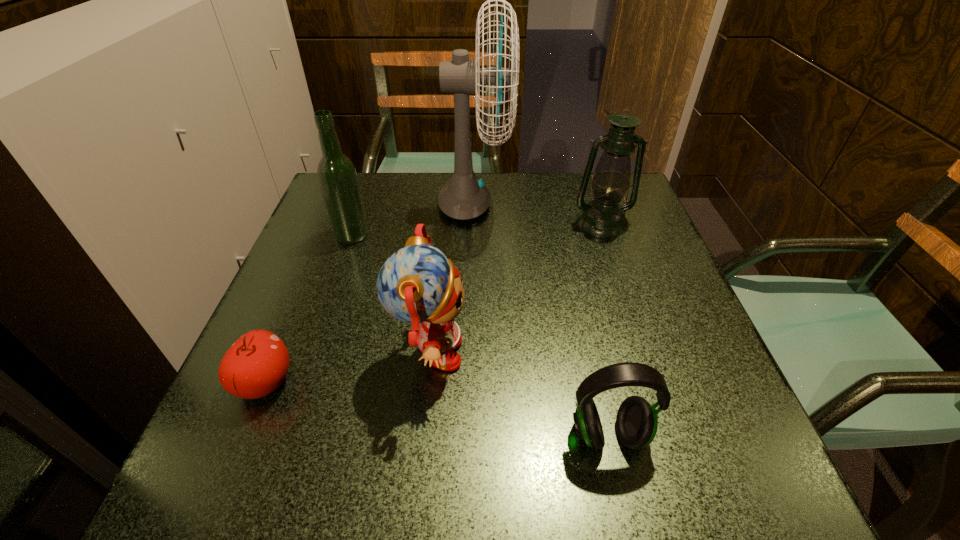
The height and width of the screenshot is (540, 960). In the image, there is a desktop. In order to click on vacant area at the far edge in this screenshot , I will do `click(438, 174)`.

Image resolution: width=960 pixels, height=540 pixels. In the image, there is a desktop. What are the coordinates of `vacant space at the near edge` in the screenshot? It's located at (634, 460).

Locate an element on the screen. The image size is (960, 540). vacant space at the left edge of the desktop is located at coordinates (305, 342).

Locate an element on the screen. vacant space at the right edge is located at coordinates (684, 314).

In the image, there is a desktop. At what (x,y) coordinates should I click in order to perform the action: click on free space at the far left corner. Please return your answer as a coordinate pair (x, y). This screenshot has width=960, height=540. Looking at the image, I should click on (320, 213).

Locate an element on the screen. free space at the near left corner of the desktop is located at coordinates (190, 503).

Where is `free region at the far right corner of the desktop`? Image resolution: width=960 pixels, height=540 pixels. free region at the far right corner of the desktop is located at coordinates (572, 175).

The image size is (960, 540). Find the location of `vacant region at the near right corner of the desktop`. vacant region at the near right corner of the desktop is located at coordinates (701, 470).

Where is `empty location between the oil lamp and the fourth tallest object`? This screenshot has width=960, height=540. empty location between the oil lamp and the fourth tallest object is located at coordinates (516, 288).

Where is `empty space between the tallest object and the oil lamp`? The width and height of the screenshot is (960, 540). empty space between the tallest object and the oil lamp is located at coordinates (538, 214).